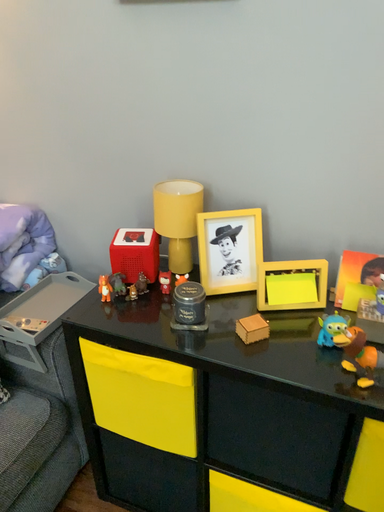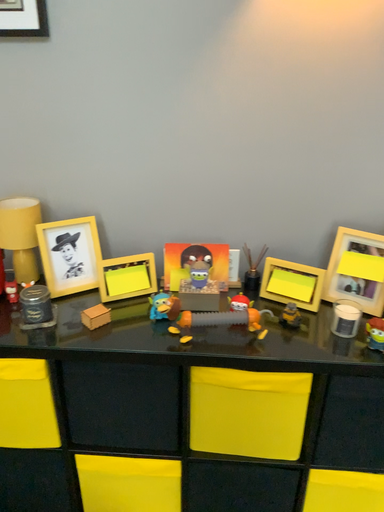
Question: Which way did the camera rotate in the video?

Choices:
 (A) rotated right
 (B) rotated left

Answer: (A)